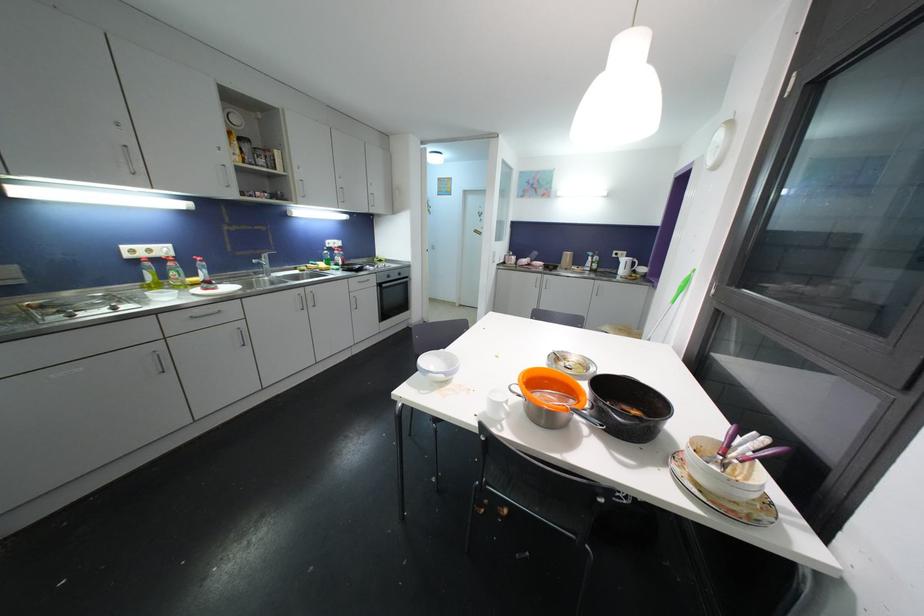
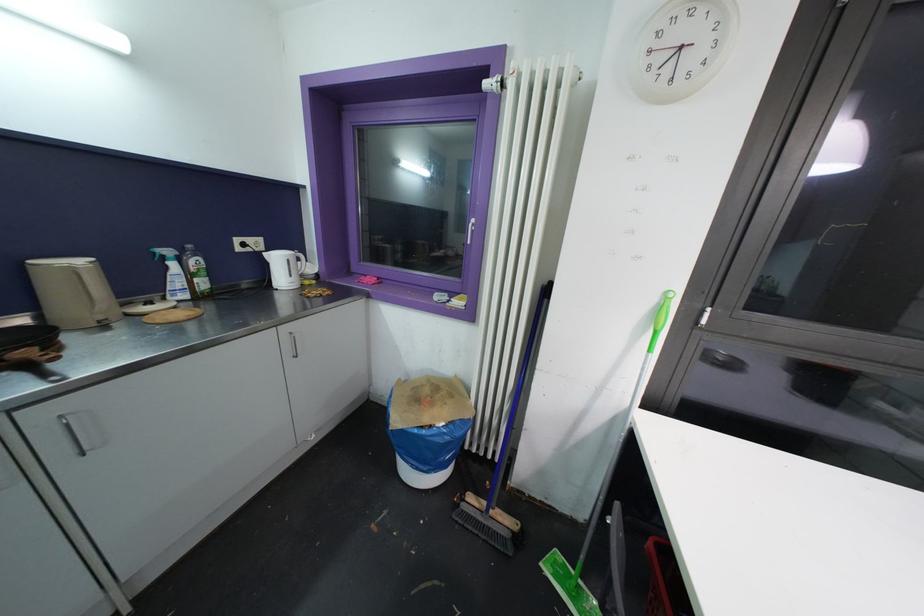
In the second image, find the point that corresponds to (x=593, y=256) in the first image.

(171, 254)